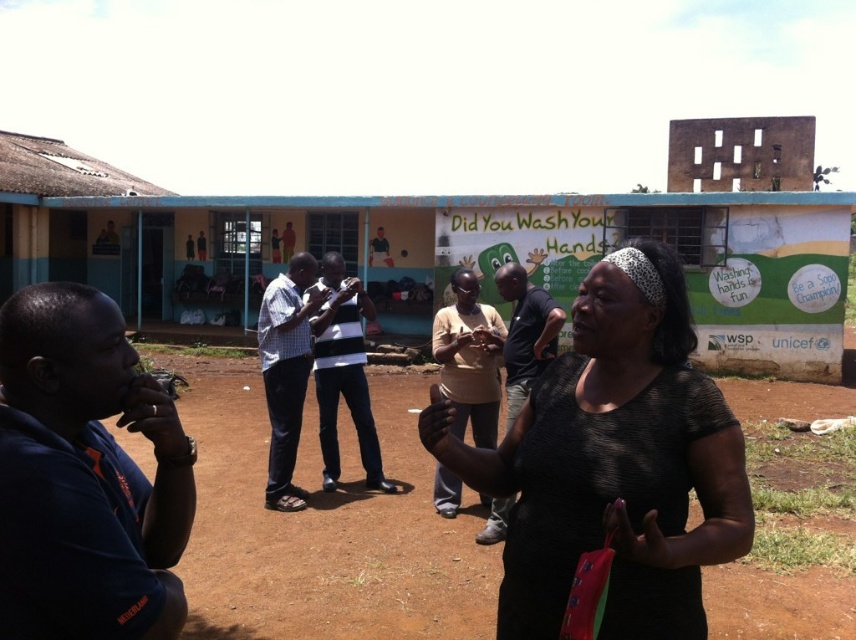
Question: Is the position of brown dirt field at center more distant than that of checkered fabric shirt at center?

Choices:
 (A) yes
 (B) no

Answer: (B)

Question: Among these objects, which one is nearest to the camera?

Choices:
 (A) light brown leather shirt at center
 (B) striped cotton shirt at center

Answer: (A)

Question: Considering the relative positions of dark blue shirt at left and striped cotton shirt at center in the image provided, where is dark blue shirt at left located with respect to striped cotton shirt at center?

Choices:
 (A) above
 (B) below

Answer: (A)

Question: Does striped cotton shirt at center come behind light brown leather shirt at center?

Choices:
 (A) yes
 (B) no

Answer: (A)

Question: Which point is farther to the camera?

Choices:
 (A) light brown cotton shirt at center
 (B) dark blue shirt at left
 (C) textured black shirt at center

Answer: (A)

Question: Which is nearer to the light brown cotton shirt at center?

Choices:
 (A) checkered fabric shirt at center
 (B) striped cotton shirt at center

Answer: (B)